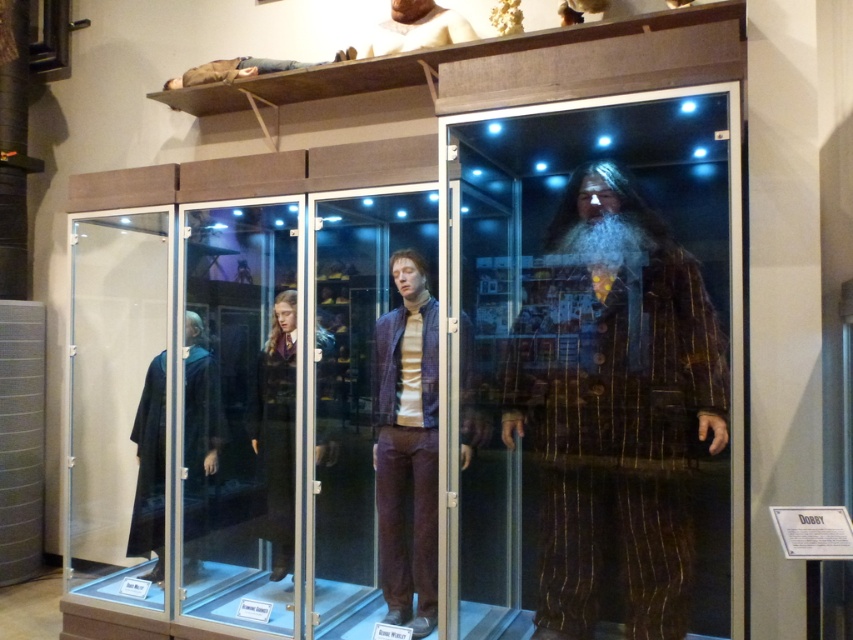
Question: Which point is farther to the camera?

Choices:
 (A) (683, 449)
 (B) (190, 493)
 (C) (387, 531)

Answer: (B)

Question: Is purple matte suit at center thinner than dark blue velvet robe at left?

Choices:
 (A) yes
 (B) no

Answer: (A)

Question: Is brown striped suit at center below purple matte suit at center?

Choices:
 (A) no
 (B) yes

Answer: (A)

Question: Does brown striped suit at center have a greater width compared to purple matte suit at center?

Choices:
 (A) no
 (B) yes

Answer: (B)

Question: Which object is positioned farthest from the purple matte suit at center?

Choices:
 (A) brown striped suit at center
 (B) dark blue velvet robe at left

Answer: (B)

Question: Among these objects, which one is nearest to the camera?

Choices:
 (A) purple matte suit at center
 (B) dark blue velvet robe at left
 (C) brown striped suit at center

Answer: (C)